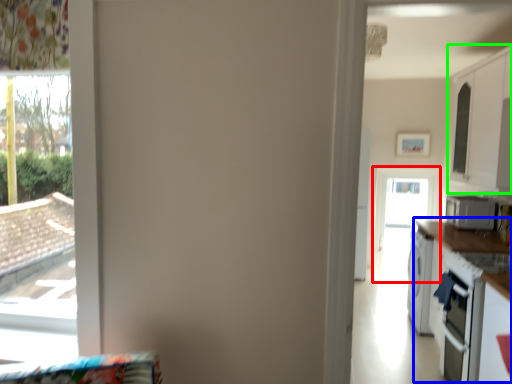
Question: Estimate the real-world distances between objects in this image. Which object is farther from screen door (highlighted by a red box), counter top (highlighted by a blue box) or cabinetry (highlighted by a green box)?

Choices:
 (A) counter top
 (B) cabinetry

Answer: (A)